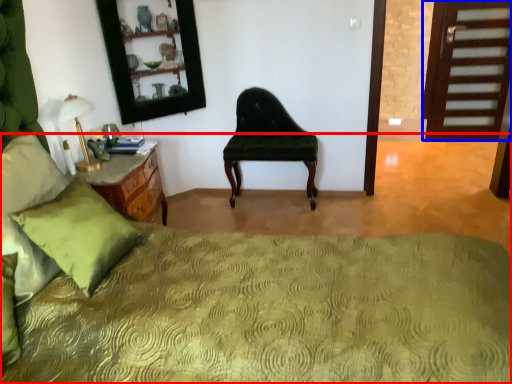
Question: Among these objects, which one is nearest to the camera, bed (highlighted by a red box) or door (highlighted by a blue box)?

Choices:
 (A) bed
 (B) door

Answer: (A)